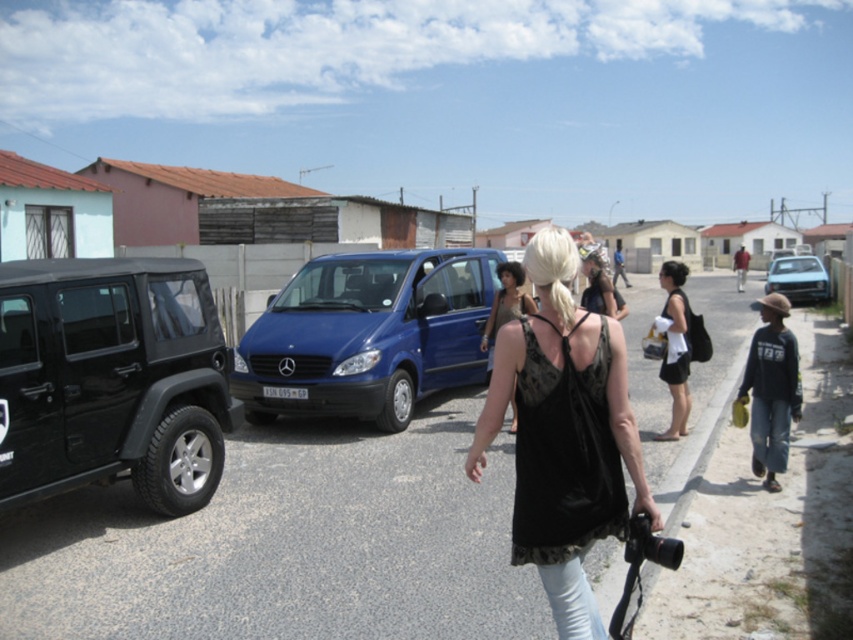
You are a delivery person trying to navigate through the street. There is a shiny black jeep at left and a black lace tank top at center. Which object is wider?

The shiny black jeep at left is wider than the black lace tank top at center according to the description.

You are a delivery person who needs to deliver a package to the address located at the center of the image. There is a matte black dress at center and a blue metallic sedan at right in the way. Can you pass through between them?

The matte black dress at center is thinner than the blue metallic sedan at right, so yes, you can pass through between them since the space between them is wider than the package carrier.

You are standing at point (473, 476) and want to walk to point (16, 397). Is the destination point in front of or behind you?

The destination point (16, 397) is behind you because it is located behind point (473, 476) where you are standing.